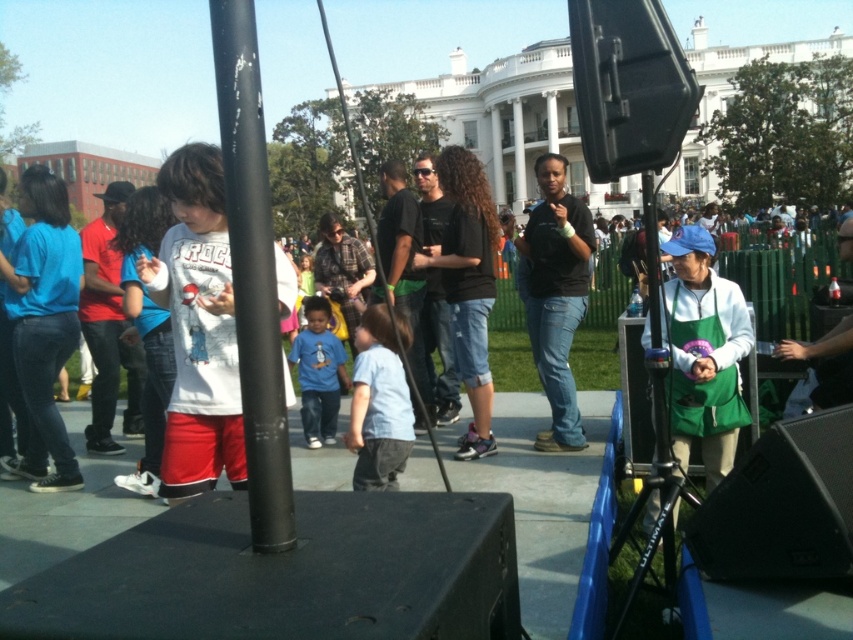
Between white matte shirt at center and matte red shirt at center, which one appears on the left side from the viewer's perspective?

matte red shirt at center

Between white matte shirt at center and matte red shirt at center, which one is positioned higher?

Positioned higher is matte red shirt at center.

Is point (187, 344) more distant than point (107, 256)?

No.

Where is `white matte shirt at center`? This screenshot has width=853, height=640. white matte shirt at center is located at coordinates (198, 326).

Is black matte shirt at center below light blue fabric shirt at center?

Incorrect, black matte shirt at center is not positioned below light blue fabric shirt at center.

Who is more distant from viewer, (x=552, y=179) or (x=387, y=410)?

Point (x=552, y=179)

This screenshot has width=853, height=640. What do you see at coordinates (556, 296) in the screenshot?
I see `black matte shirt at center` at bounding box center [556, 296].

The height and width of the screenshot is (640, 853). I want to click on black matte shirt at center, so click(x=556, y=296).

Is point (277, 374) farther from viewer compared to point (352, 349)?

No, it is in front of (352, 349).

The width and height of the screenshot is (853, 640). Identify the location of black matte pole at center. (252, 275).